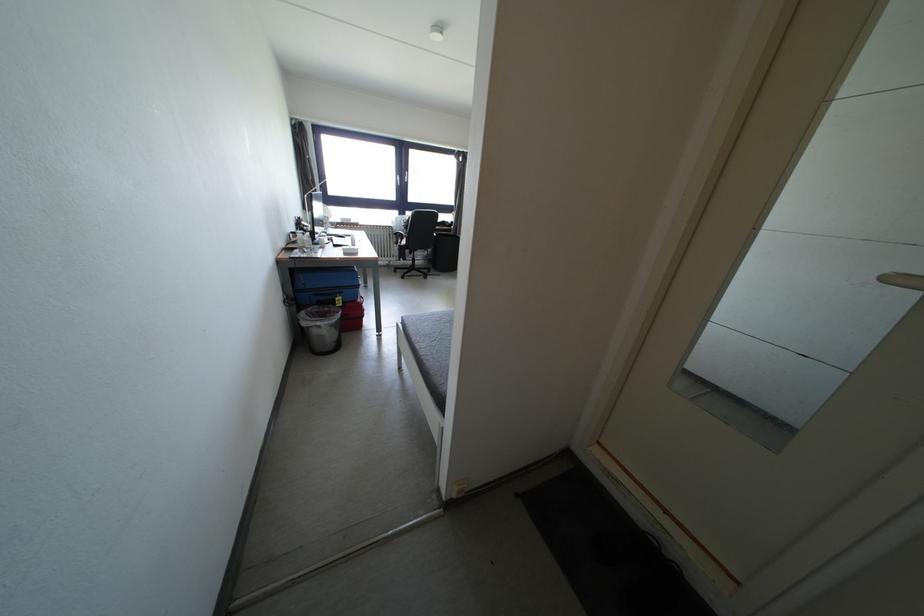
Find where to sit the sofa sitting surface. Please return your answer as a coordinate pair (x, y).

(431, 342)